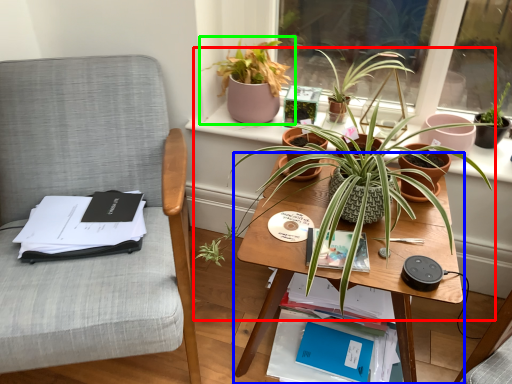
Question: Which is nearer to the houseplant (highlighted by a red box)? table (highlighted by a blue box) or houseplant (highlighted by a green box).

Choices:
 (A) table
 (B) houseplant

Answer: (A)